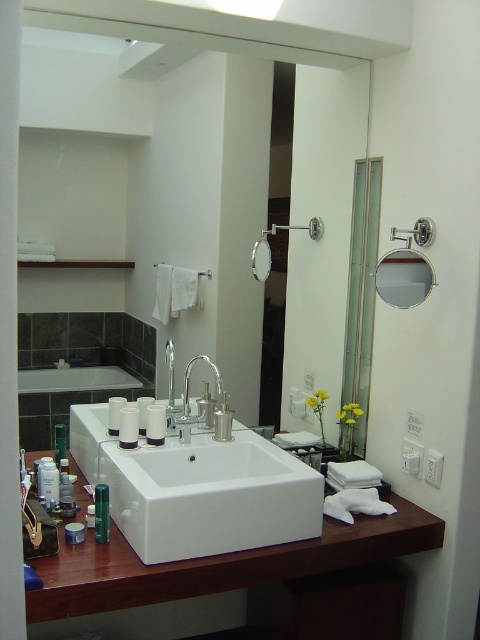
Based on the photo, you are standing in the bathroom and want to reach the point marked as point [200,356]. If your arm can extend 2 meters, can you reach it?

The point [200,356] is 2.11 meters away from the camera, so your arm can only extend 2 meters, which is shorter than the distance. Therefore, you cannot reach it.

You are organizing the bathroom and need to place a new decorative item on the white glossy countertop at center. However, there is already a green matte tube at center there. Where exactly should you place the new item to ensure it doesn t interfere with the existing tube?

Since the white glossy countertop at center is located below the green matte tube at center, you can place the new decorative item on the countertop below the green matte tube at center without interfering with it.